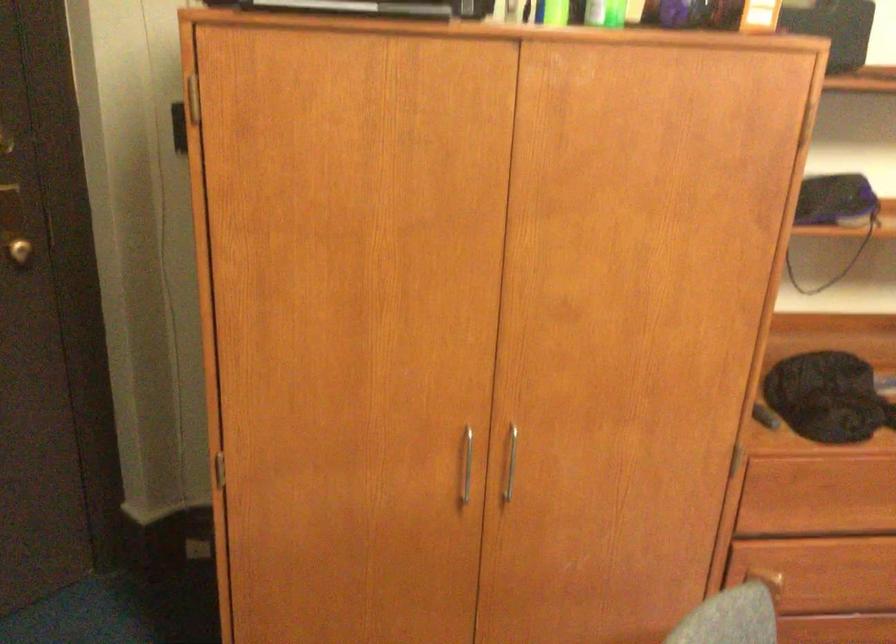
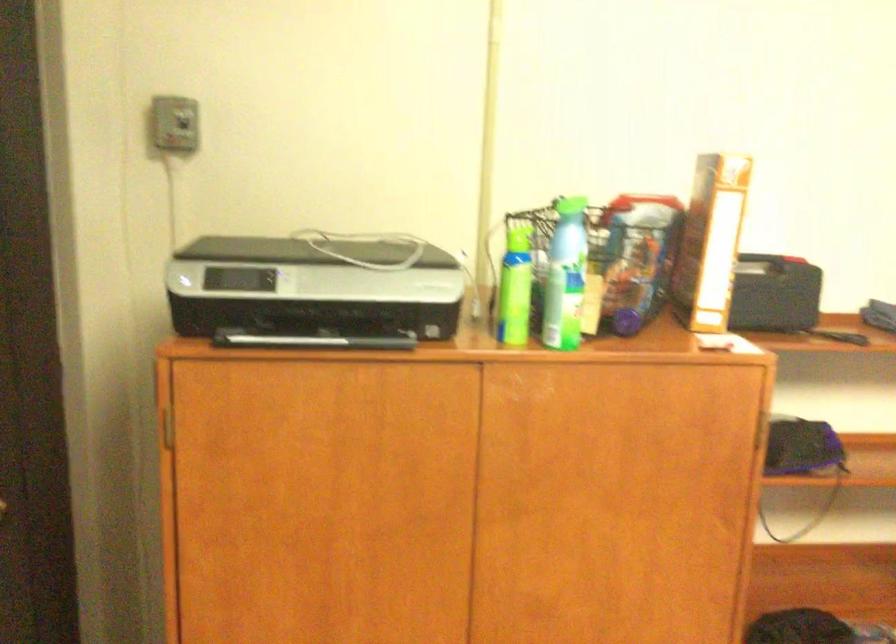
Which direction would the cameraman need to move to produce the second image?

The movement direction of the cameraman is right, backward.